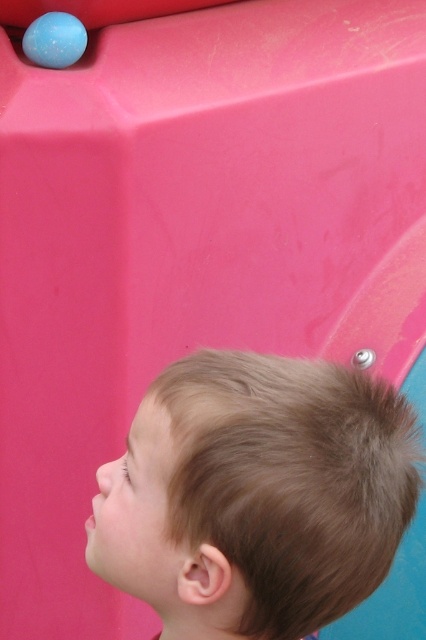
Question: Does brown hair at upper right have a larger size compared to matte blue ball at upper left?

Choices:
 (A) no
 (B) yes

Answer: (B)

Question: Which of the following is the farthest from the observer?

Choices:
 (A) brown hair at upper right
 (B) matte blue ball at upper left

Answer: (B)

Question: Which of the following is the closest to the observer?

Choices:
 (A) brown hair at upper right
 (B) matte blue ball at upper left

Answer: (A)

Question: Does brown hair at upper right appear on the left side of matte blue ball at upper left?

Choices:
 (A) yes
 (B) no

Answer: (B)

Question: Which point is closer to the camera?

Choices:
 (A) matte blue ball at upper left
 (B) brown hair at upper right

Answer: (B)

Question: Is the position of brown hair at upper right more distant than that of matte blue ball at upper left?

Choices:
 (A) yes
 (B) no

Answer: (B)